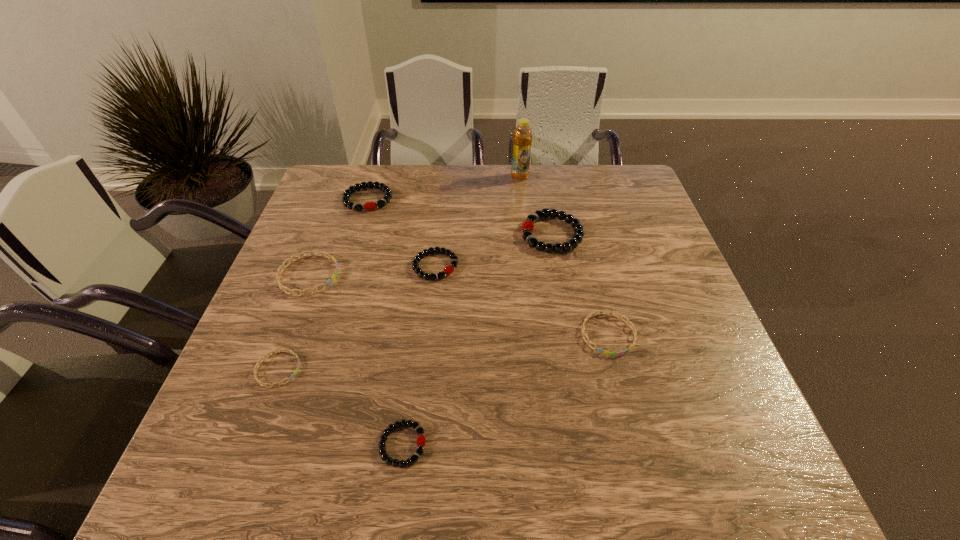
This screenshot has width=960, height=540. Identify the location of vacant region that satisfies the following two spatial constraints: 1. on the surface of the second biggest blue bracelet showing star-shaped elements; 2. on the surface of the shortest bracelet showing star-shaped elements. (617, 369).

The width and height of the screenshot is (960, 540). In order to click on vacant area in the image that satisfies the following two spatial constraints: 1. on the front side of the biggest black bracelet; 2. on the right side of the seventh nearest object in this screenshot , I will do `click(357, 234)`.